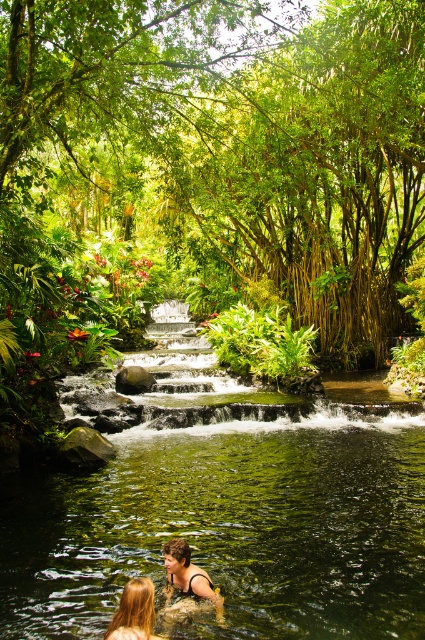
You are a photographer capturing a portrait of two people with blonde hair at lower center and smooth brown hair at lower center in this natural setting. Which person has hair strands that are thinner?

The blonde hair at lower center has thinner strands than the smooth brown hair at lower center.